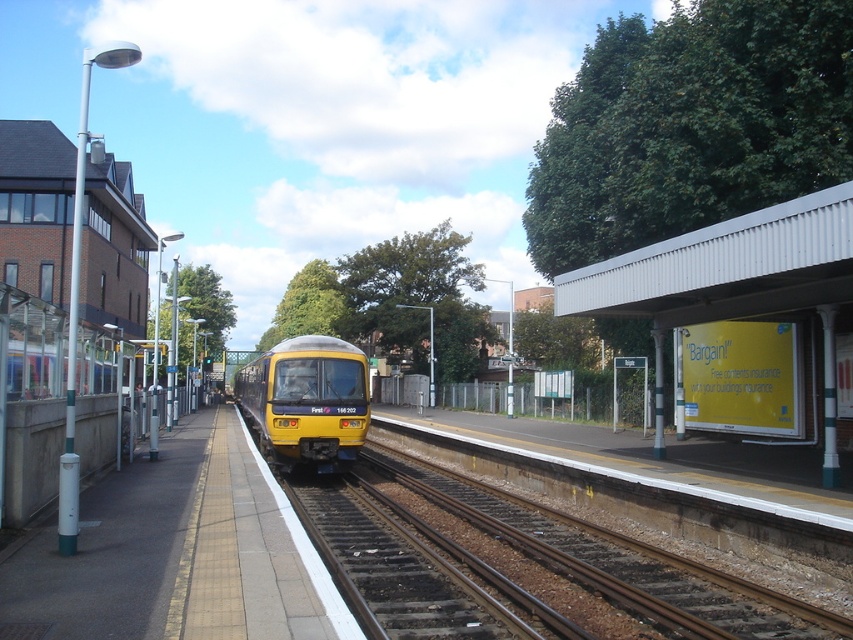
You are a passenger standing on the smooth concrete platform at center. You see the yellow matte train at center approaching. Based on their widths, can you tell if the train will fit on the platform?

The smooth concrete platform at center is thinner than yellow matte train at center, so the train will not fit on the platform.